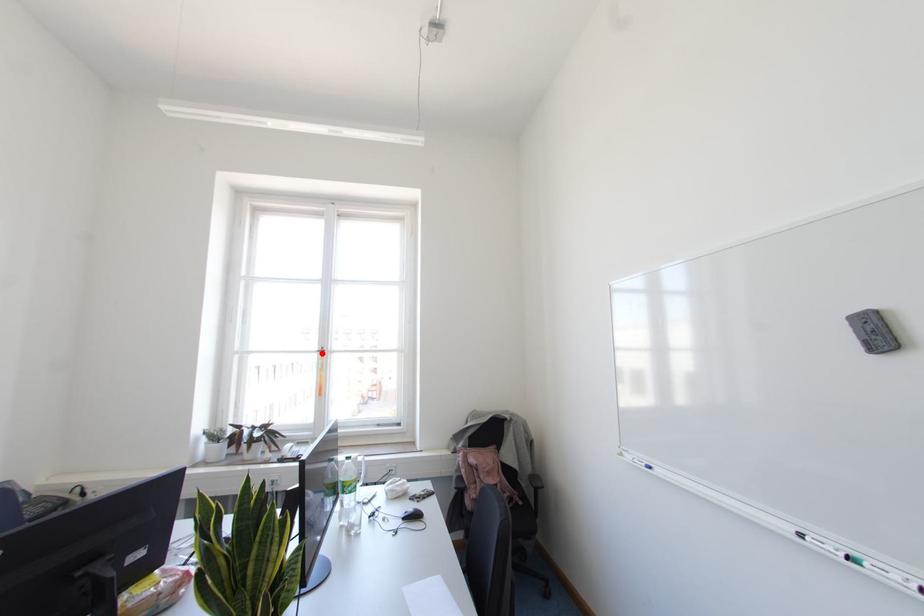
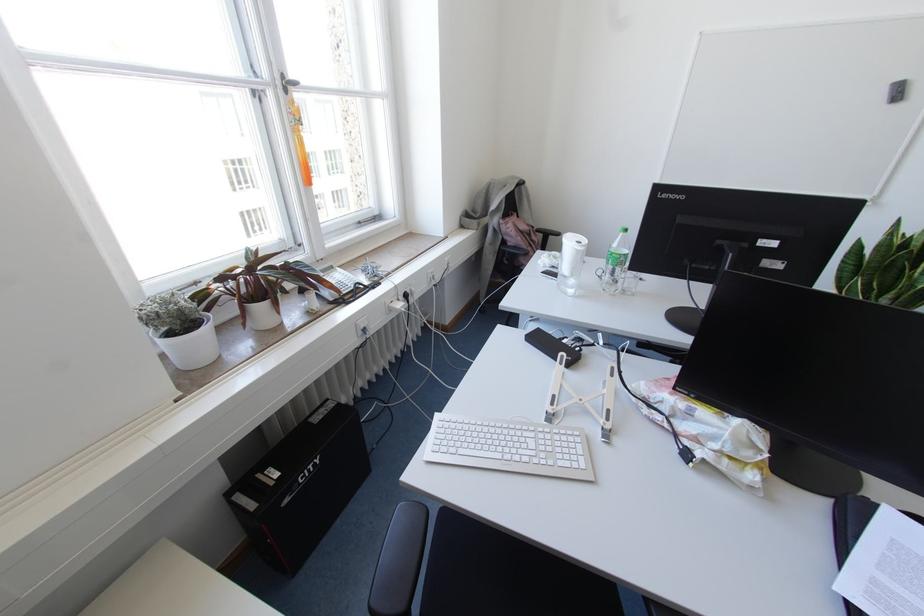
Find the pixel in the second image that matches the highlighted location in the first image.

(285, 90)